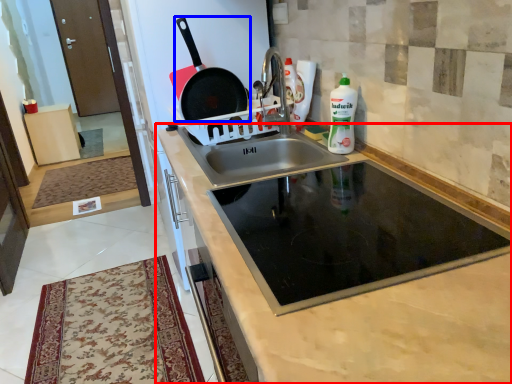
Question: Which point is closer to the camera, cabinetry (highlighted by a red box) or frying pan (highlighted by a blue box)?

Choices:
 (A) cabinetry
 (B) frying pan

Answer: (A)